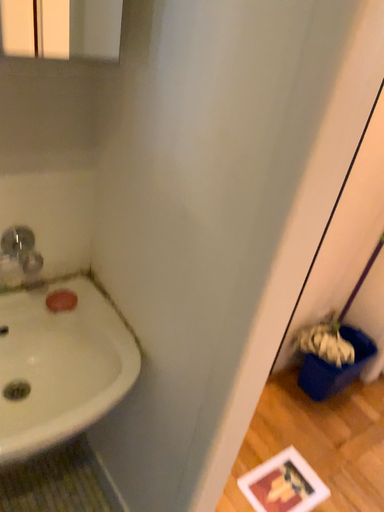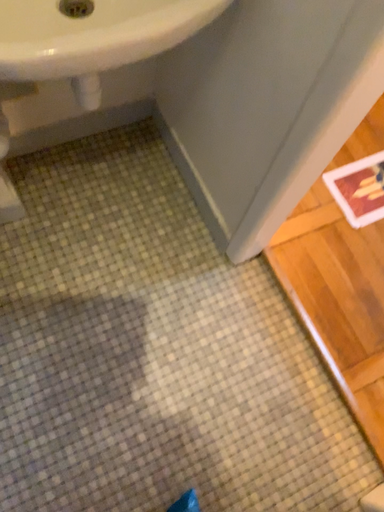
Question: Which way did the camera rotate in the video?

Choices:
 (A) rotated upward
 (B) rotated downward

Answer: (B)